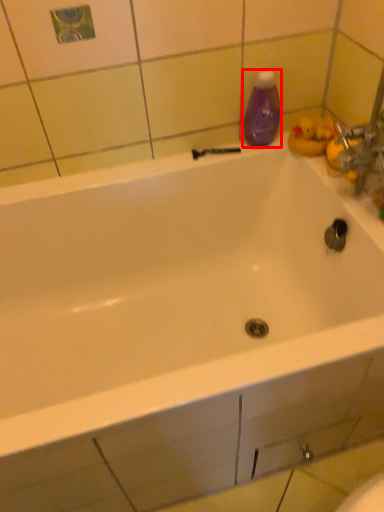
Question: From the image, what is the correct spatial relationship of cleaning product (annotated by the red box) in relation to shower?

Choices:
 (A) right
 (B) left

Answer: (A)